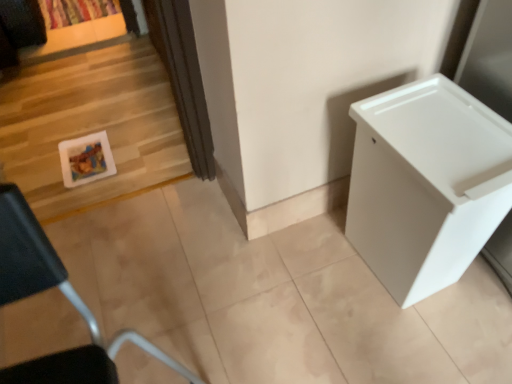
Locate an element on the screen. This screenshot has width=512, height=384. free space to the back side of white plastic container at lower left is located at coordinates pos(182,330).